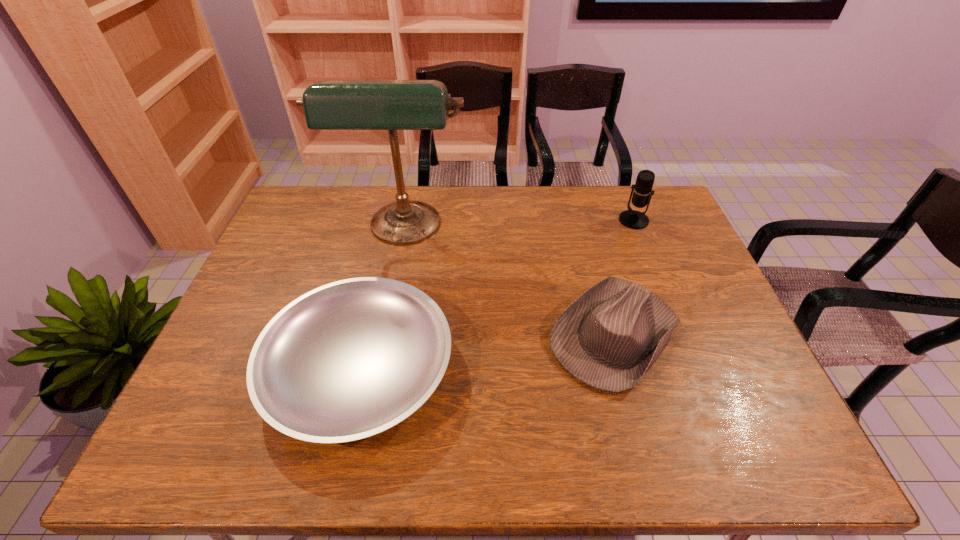
The image size is (960, 540). I want to click on vacant region at the near left corner, so click(x=165, y=447).

The image size is (960, 540). Identify the location of vacant area between the fedora and the microphone. (625, 278).

This screenshot has width=960, height=540. What are the coordinates of `free area in between the fedora and the table lamp` in the screenshot? It's located at (510, 282).

Locate an element on the screen. unoccupied position between the microphone and the fedora is located at coordinates (625, 278).

The image size is (960, 540). I want to click on vacant space that's between the second tallest object and the tallest object, so click(x=519, y=225).

Locate an element on the screen. This screenshot has height=540, width=960. vacant area between the shortest object and the second shortest object is located at coordinates (488, 352).

Find the location of a particular element. The height and width of the screenshot is (540, 960). vacant region between the table lamp and the second shortest object is located at coordinates (510, 282).

Identify the location of free spot between the bedpan and the third shortest object. Image resolution: width=960 pixels, height=540 pixels. (496, 295).

Find the location of a particular element. Image resolution: width=960 pixels, height=540 pixels. empty space between the fedora and the second tallest object is located at coordinates (625, 278).

This screenshot has width=960, height=540. I want to click on unoccupied position between the microphone and the fedora, so click(x=625, y=278).